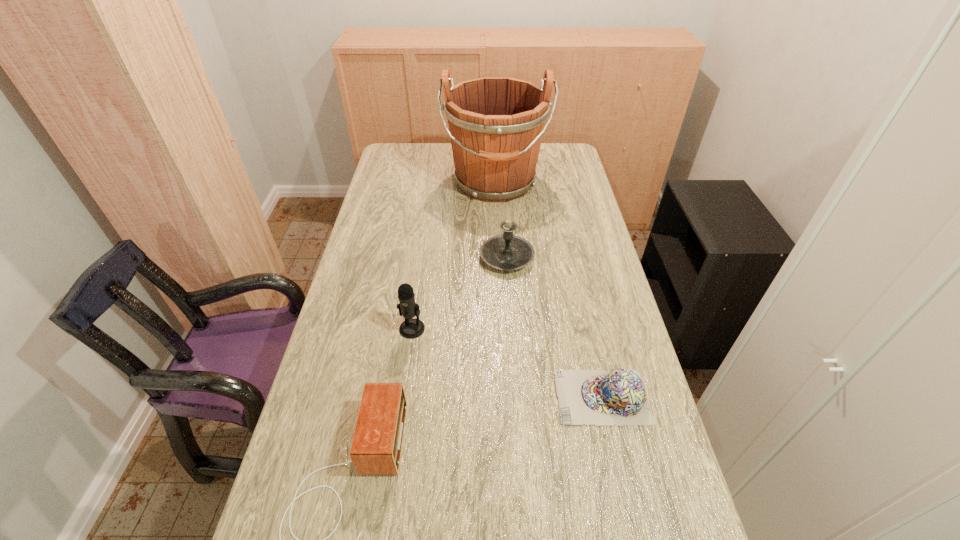
You are a GUI agent. You are given a task and a screenshot of the screen. Output one action in this format:
    pyautogui.click(x=<x>, y=<y>)
    Task: Click on the empty space between the candle and the cap
    This screenshot has height=540, width=960.
    Given the screenshot: What is the action you would take?
    pyautogui.click(x=555, y=327)

Where is `object that is the fourth nearest to the fourth nearest object`? This screenshot has width=960, height=540. object that is the fourth nearest to the fourth nearest object is located at coordinates (376, 447).

Locate which object ranks fourth in proximity to the second shortest object. Please provide its 2D coordinates. Your answer should be formatted as a tuple, i.e. [(x, y)], where the tuple contains the x and y coordinates of a point satisfying the conditions above.

[(496, 124)]